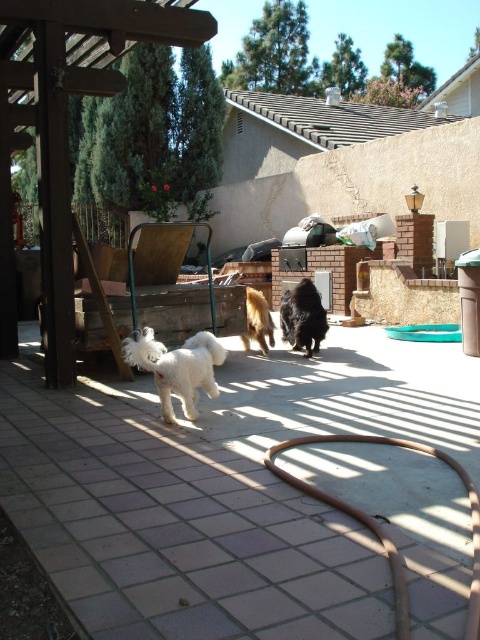
You are standing on the patio and see the black fuzzy dog at center and the golden fur dog at center. Which dog is closer to you?

The black fuzzy dog at center is closer to you because it is in front of the golden fur dog at center.

You are a photographer setting up a camera to capture the two dogs in the scene. The camera has a limited frame width of 1.2 meters. Given that the white fluffy dog at center is wider than the golden fur dog at center, will both dogs fit within the frame if they are positioned side by side?

The white fluffy dog at center is wider than the golden fur dog at center. However, without knowing the exact combined width of both dogs, it is impossible to determine if they will fit within the 1.2 meter frame. Additional information about their individual widths is needed to make an accurate assessment.

You are standing at the edge of the patio and want to throw a ball to the white fluffy dog at center. The ball you have can travel up to 3 meters. Will the ball reach the dog?

The distance between you and the white fluffy dog at center is 3.19 meters, which is slightly beyond the ball travel distance of 3 meters. The ball will not reach the dog.